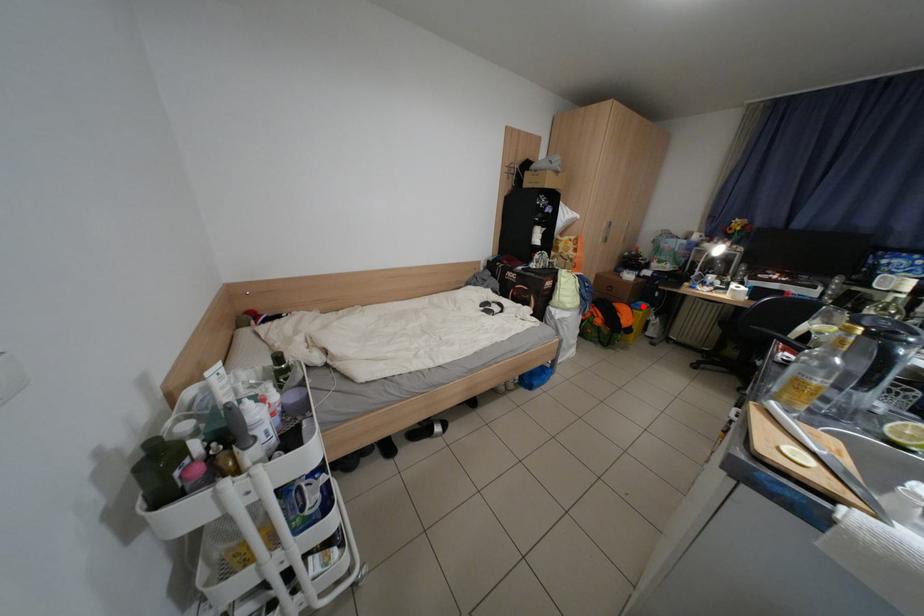
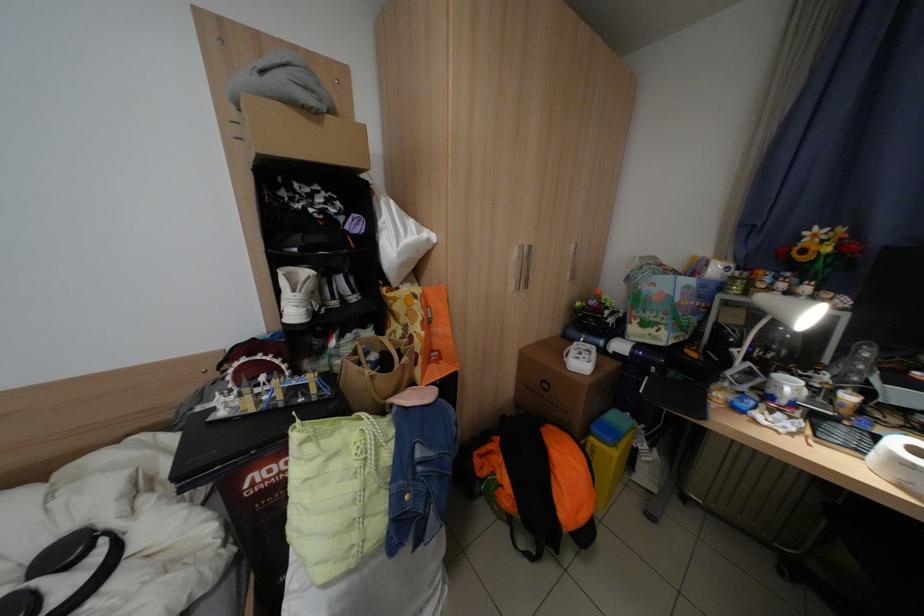
Where in the second image is the point corresponding to the highlighted location from the first image?

(604, 430)